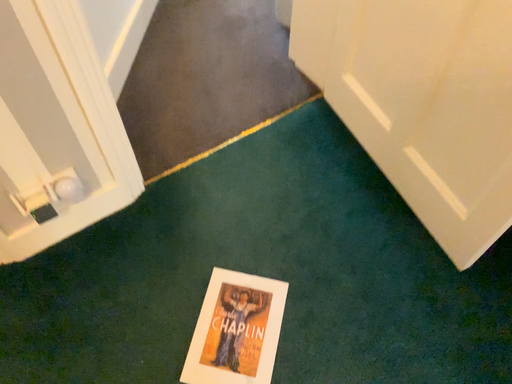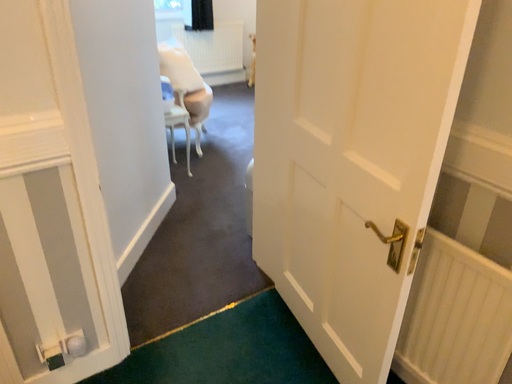
Question: Which way did the camera rotate in the video?

Choices:
 (A) rotated upward
 (B) rotated downward

Answer: (A)